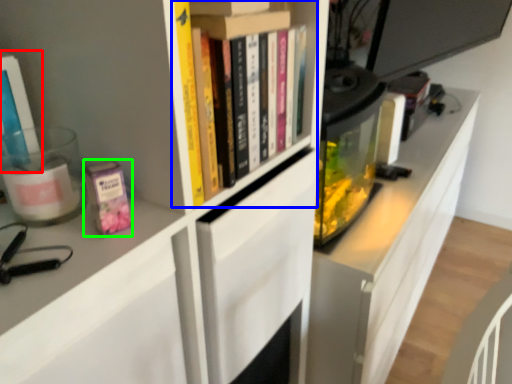
Question: Which object is positioned closest to book (highlighted by a red box)? Select from book (highlighted by a blue box) and paperback book (highlighted by a green box).

Choices:
 (A) book
 (B) paperback book

Answer: (B)